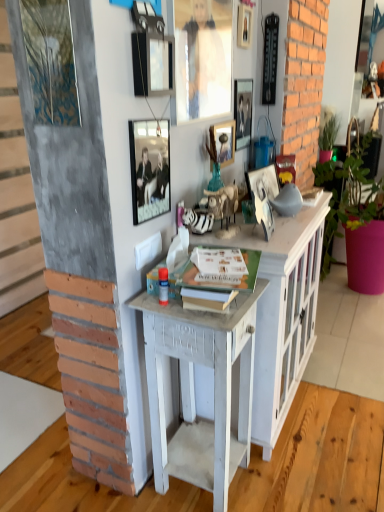
Question: Should I look upward or downward to see matte black picture frame at upper center, which ranks as the 6th picture frame in right-to-left order?

Choices:
 (A) down
 (B) up

Answer: (B)

Question: Can you confirm if metallic silver picture frame at upper center, which is counted as the 6th picture frame, starting from the left, is thinner than matte black picture frame at upper center, which ranks as the 6th picture frame in right-to-left order?

Choices:
 (A) no
 (B) yes

Answer: (B)

Question: Can you confirm if metallic silver picture frame at upper center, which is counted as the 6th picture frame, starting from the left, is shorter than matte black picture frame at upper center, arranged as the second picture frame when viewed from the left?

Choices:
 (A) no
 (B) yes

Answer: (A)

Question: From the image's perspective, is metallic silver picture frame at upper center, marked as the second picture frame in a right-to-left arrangement, over matte black picture frame at upper center, arranged as the second picture frame when viewed from the left?

Choices:
 (A) no
 (B) yes

Answer: (B)

Question: From a real-world perspective, is metallic silver picture frame at upper center, which is counted as the 6th picture frame, starting from the left, located beneath matte black picture frame at upper center, arranged as the second picture frame when viewed from the left?

Choices:
 (A) no
 (B) yes

Answer: (B)

Question: Can you confirm if metallic silver picture frame at upper center, which is counted as the 6th picture frame, starting from the left, is positioned to the right of matte black picture frame at upper center, arranged as the second picture frame when viewed from the left?

Choices:
 (A) no
 (B) yes

Answer: (B)

Question: Is metallic silver picture frame at upper center, marked as the second picture frame in a right-to-left arrangement, not close to matte black picture frame at upper center, arranged as the second picture frame when viewed from the left?

Choices:
 (A) no
 (B) yes

Answer: (A)

Question: Does metallic silver picture frame at center, which is the 7th picture frame from left to right, contain metallic silver picture frame at upper center, marked as the second picture frame in a right-to-left arrangement?

Choices:
 (A) yes
 (B) no

Answer: (B)

Question: Can you confirm if metallic silver picture frame at center, which is the 7th picture frame from left to right, is taller than metallic silver picture frame at upper center, which is counted as the 6th picture frame, starting from the left?

Choices:
 (A) yes
 (B) no

Answer: (B)

Question: Is the position of metallic silver picture frame at center, acting as the 1th picture frame starting from the right, more distant than that of metallic silver picture frame at upper center, marked as the second picture frame in a right-to-left arrangement?

Choices:
 (A) yes
 (B) no

Answer: (B)

Question: Is metallic silver picture frame at center, acting as the 1th picture frame starting from the right, in contact with metallic silver picture frame at upper center, marked as the second picture frame in a right-to-left arrangement?

Choices:
 (A) no
 (B) yes

Answer: (A)

Question: Considering the relative sizes of metallic silver picture frame at center, acting as the 1th picture frame starting from the right, and metallic silver picture frame at upper center, which is counted as the 6th picture frame, starting from the left, in the image provided, is metallic silver picture frame at center, acting as the 1th picture frame starting from the right, shorter than metallic silver picture frame at upper center, which is counted as the 6th picture frame, starting from the left,?

Choices:
 (A) yes
 (B) no

Answer: (A)

Question: Is metallic silver picture frame at center, which is the 7th picture frame from left to right, oriented towards metallic silver picture frame at upper center, which is counted as the 6th picture frame, starting from the left?

Choices:
 (A) yes
 (B) no

Answer: (B)

Question: Is white painted wood desk at center far away from metallic silver picture frame at upper center, which is counted as the 6th picture frame, starting from the left?

Choices:
 (A) no
 (B) yes

Answer: (B)